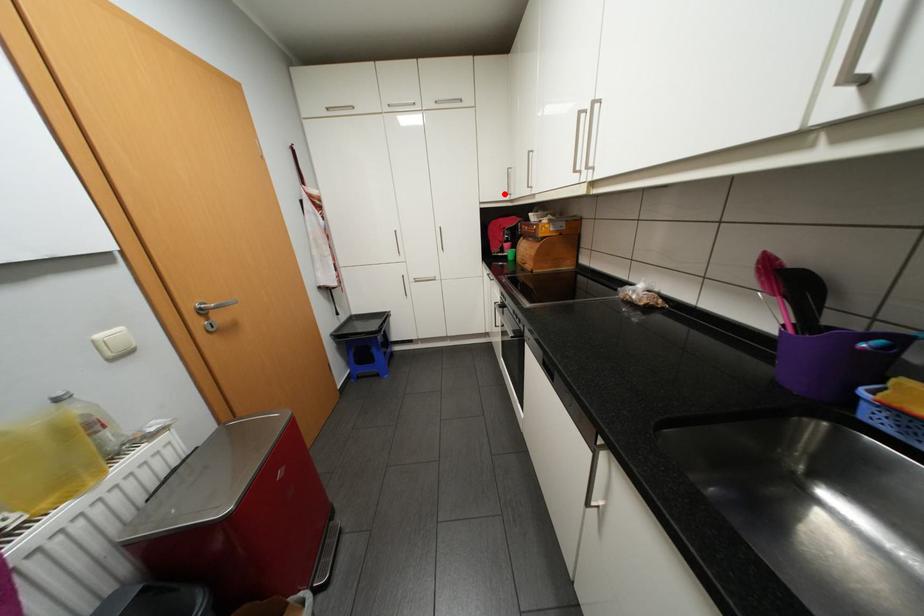
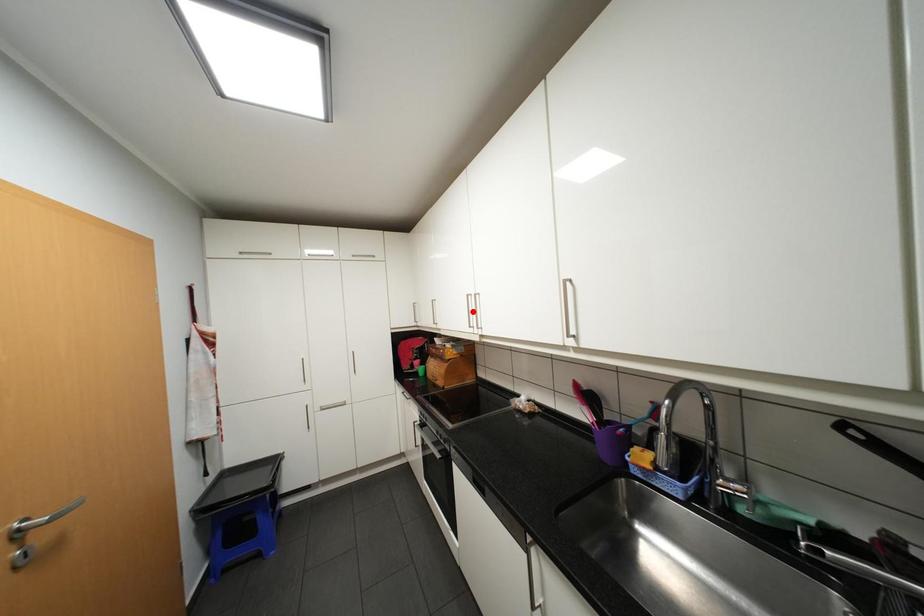
I am providing you with two images of the same scene from different viewpoints. A red point is marked on the first image and another point is marked on the second image. Is the red point in image1 aligned with the point shown in image2?

No